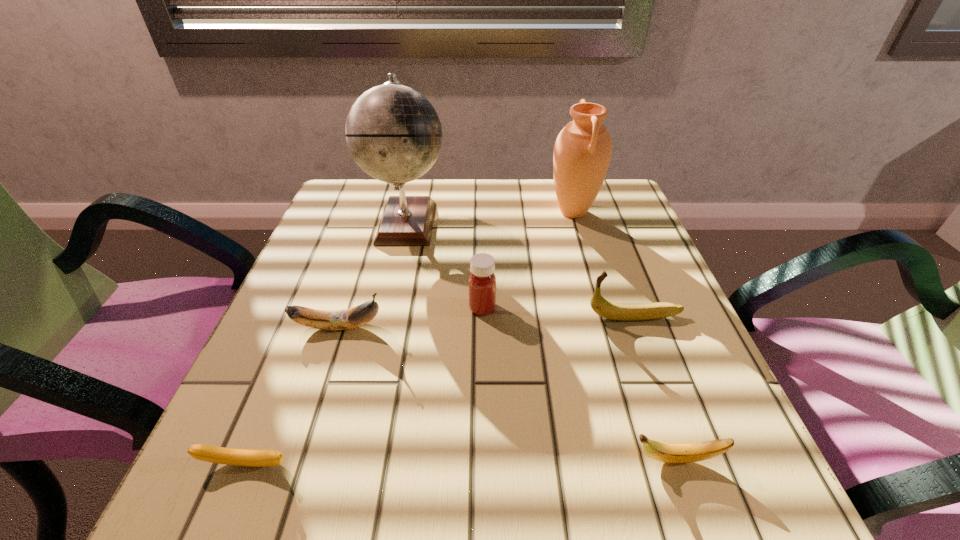
I want to click on free spot between the shortest object and the urn, so pyautogui.click(x=410, y=339).

Point out which object is positioned as the nearest to the urn. Please provide its 2D coordinates. Your answer should be formatted as a tuple, i.e. [(x, y)], where the tuple contains the x and y coordinates of a point satisfying the conditions above.

[(394, 134)]

Locate an element on the screen. This screenshot has height=540, width=960. object that can be found as the fifth closest to the fourth object from left to right is located at coordinates (668, 453).

Select which banana appears as the third closest to the second tallest object. Please provide its 2D coordinates. Your answer should be formatted as a tuple, i.e. [(x, y)], where the tuple contains the x and y coordinates of a point satisfying the conditions above.

[(668, 453)]

The height and width of the screenshot is (540, 960). I want to click on banana that can be found as the second closest to the globe, so click(x=616, y=311).

Where is `free point that satisfies the following two spatial constraints: 1. at the stem of the second shortest object; 2. at the stem of the shortest banana`? This screenshot has height=540, width=960. free point that satisfies the following two spatial constraints: 1. at the stem of the second shortest object; 2. at the stem of the shortest banana is located at coordinates (677, 465).